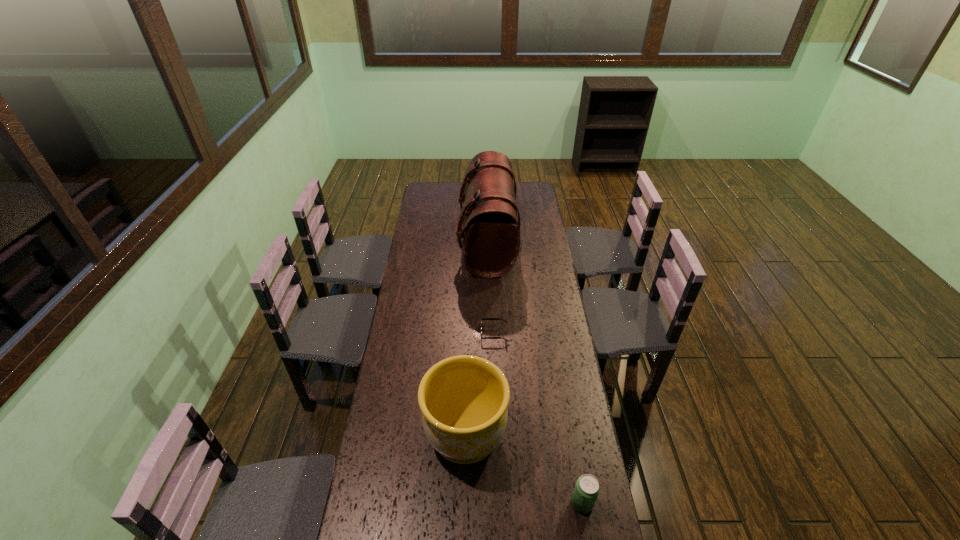
In order to click on vacant space at the far right corner in this screenshot , I will do `click(524, 202)`.

At what (x,y) coordinates should I click in order to perform the action: click on free space that is in between the farthest object and the third nearest object. Please return your answer as a coordinate pair (x, y). Image resolution: width=960 pixels, height=540 pixels. Looking at the image, I should click on (491, 288).

Where is `blank region between the farthest object and the rightmost object`? This screenshot has width=960, height=540. blank region between the farthest object and the rightmost object is located at coordinates click(535, 373).

The height and width of the screenshot is (540, 960). I want to click on free space between the nearest object and the farthest object, so click(x=535, y=373).

The height and width of the screenshot is (540, 960). I want to click on empty location between the flowerpot and the second shortest object, so click(524, 469).

The width and height of the screenshot is (960, 540). I want to click on vacant point located between the flowerpot and the soda, so click(524, 469).

In order to click on free space between the farthest object and the shortest object in this screenshot , I will do point(491,288).

Identify the location of free area in between the satchel and the rightmost object. Image resolution: width=960 pixels, height=540 pixels. (535, 373).

The image size is (960, 540). I want to click on vacant area between the rightmost object and the tallest object, so click(x=535, y=373).

Identify which object is located as the third nearest to the tallest object. Please provide its 2D coordinates. Your answer should be formatted as a tuple, i.e. [(x, y)], where the tuple contains the x and y coordinates of a point satisfying the conditions above.

[(587, 488)]